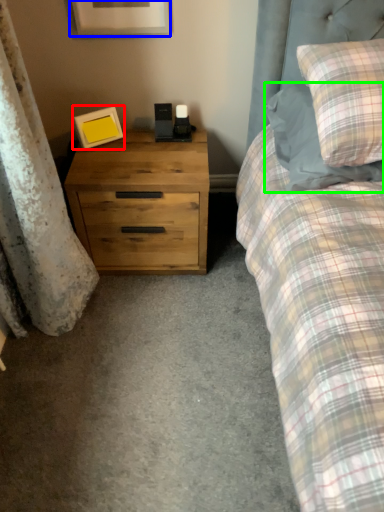
Question: Considering the real-world distances, which object is closest to picture frame (highlighted by a red box)? picture frame (highlighted by a blue box) or pillow (highlighted by a green box).

Choices:
 (A) picture frame
 (B) pillow

Answer: (A)